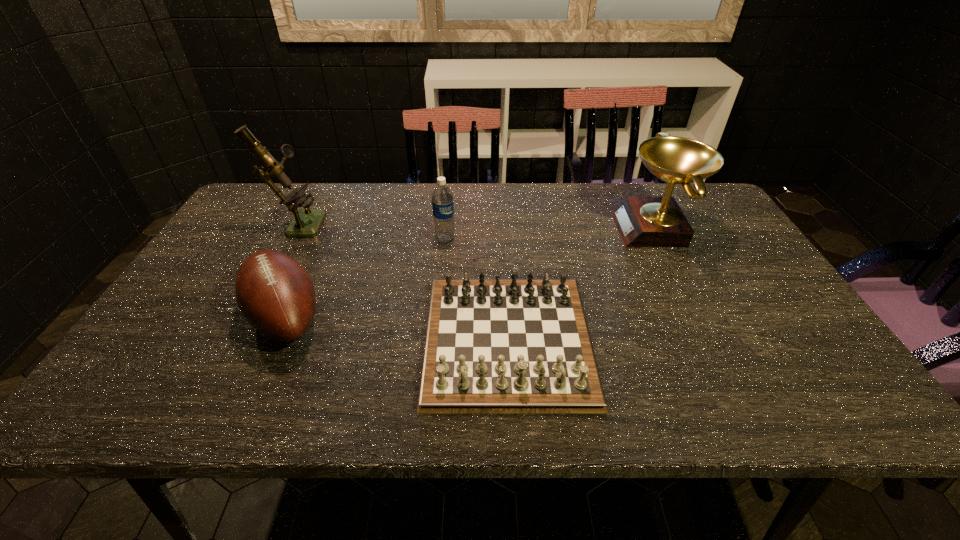
The height and width of the screenshot is (540, 960). In the image, there is a desktop. Find the location of `vacant space at the near edge`. vacant space at the near edge is located at coordinates (x=673, y=386).

This screenshot has width=960, height=540. In order to click on free space at the left edge in this screenshot , I will do `click(169, 377)`.

Image resolution: width=960 pixels, height=540 pixels. Find the location of `vacant space at the right edge of the desktop`. vacant space at the right edge of the desktop is located at coordinates pos(789,302).

At what (x,y) coordinates should I click in order to perform the action: click on vacant area at the far right corner of the desktop. Please return your answer as a coordinate pair (x, y). This screenshot has height=540, width=960. Looking at the image, I should click on (714, 219).

What are the coordinates of `empty location between the third shortest object and the microscope` in the screenshot? It's located at (372, 231).

The width and height of the screenshot is (960, 540). I want to click on vacant area that lies between the tallest object and the rightmost object, so click(476, 226).

Where is `vacant space in between the tallest object and the chessboard`? The height and width of the screenshot is (540, 960). vacant space in between the tallest object and the chessboard is located at coordinates (402, 281).

Locate an element on the screen. vacant space that's between the fourth tallest object and the water bottle is located at coordinates (366, 278).

At what (x,y) coordinates should I click in order to perform the action: click on free space between the third tallest object and the microscope. Please return your answer as a coordinate pair (x, y). Image resolution: width=960 pixels, height=540 pixels. Looking at the image, I should click on (372, 231).

Where is `empty space that is in between the rightmost object and the chessboard`? This screenshot has width=960, height=540. empty space that is in between the rightmost object and the chessboard is located at coordinates (582, 285).